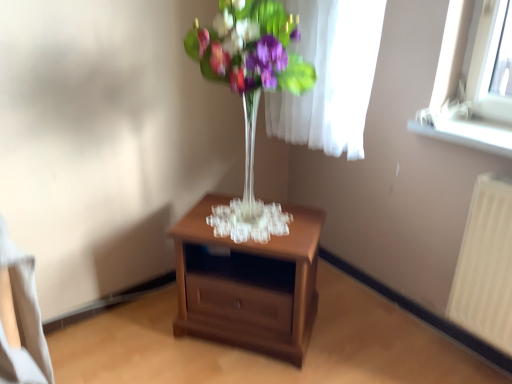
Question: From the image's perspective, would you say clear glass vase at center is shown under white plastic window sill at upper right?

Choices:
 (A) no
 (B) yes

Answer: (A)

Question: Does clear glass vase at center turn towards white plastic window sill at upper right?

Choices:
 (A) no
 (B) yes

Answer: (A)

Question: From the image's perspective, is clear glass vase at center over white plastic window sill at upper right?

Choices:
 (A) no
 (B) yes

Answer: (B)

Question: Is clear glass vase at center turned away from white plastic window sill at upper right?

Choices:
 (A) yes
 (B) no

Answer: (B)

Question: From a real-world perspective, does clear glass vase at center stand above white plastic window sill at upper right?

Choices:
 (A) no
 (B) yes

Answer: (B)

Question: Is clear glass vase at center thinner than white plastic window sill at upper right?

Choices:
 (A) yes
 (B) no

Answer: (B)

Question: Is clear glass vase at center bigger than brown wooden nightstand at center?

Choices:
 (A) no
 (B) yes

Answer: (A)

Question: From a real-world perspective, is clear glass vase at center located beneath brown wooden nightstand at center?

Choices:
 (A) no
 (B) yes

Answer: (A)

Question: Is brown wooden nightstand at center inside clear glass vase at center?

Choices:
 (A) yes
 (B) no

Answer: (B)

Question: Considering the relative sizes of clear glass vase at center and brown wooden nightstand at center in the image provided, is clear glass vase at center taller than brown wooden nightstand at center?

Choices:
 (A) no
 (B) yes

Answer: (B)

Question: Is clear glass vase at center turned away from brown wooden nightstand at center?

Choices:
 (A) no
 (B) yes

Answer: (A)

Question: Is clear glass vase at center in front of brown wooden nightstand at center?

Choices:
 (A) yes
 (B) no

Answer: (A)

Question: Is white plastic radiator at right not inside white plastic window sill at upper right?

Choices:
 (A) yes
 (B) no

Answer: (A)